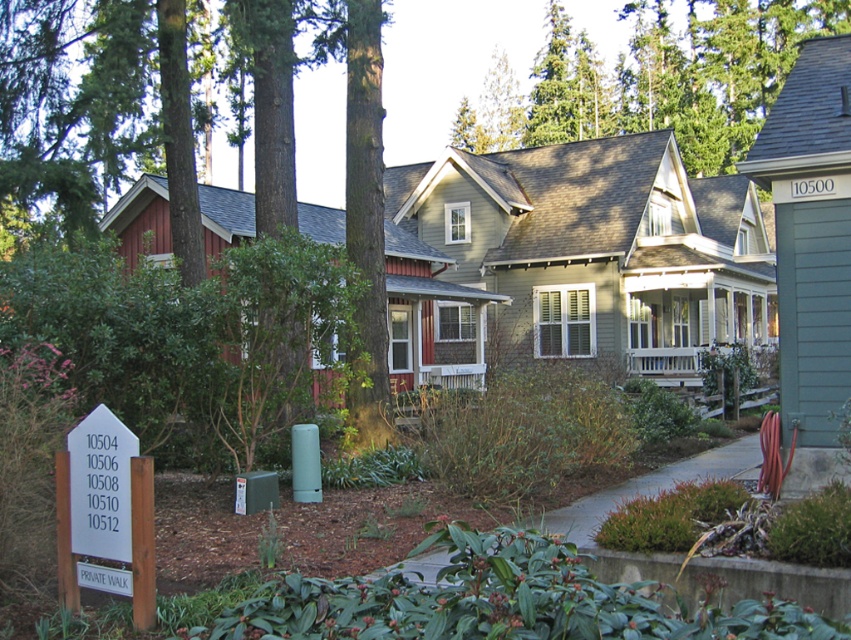
In the scene shown: Can you confirm if white plastic sign at lower left is positioned below white wooden porch at center?

Yes.

Between white plastic sign at lower left and white wooden porch at center, which one is positioned higher?

white wooden porch at center is above.

You are a GUI agent. You are given a task and a screenshot of the screen. Output one action in this format:
    pyautogui.click(x=<x>, y=<y>)
    Task: Click on the white plastic sign at lower left
    
    Given the screenshot: What is the action you would take?
    pyautogui.click(x=106, y=513)

Is green rough bark tree at left positioned behind white plastic sign at lower left?

Yes.

Is green rough bark tree at left to the left of white plastic sign at lower left from the viewer's perspective?

Yes, green rough bark tree at left is to the left of white plastic sign at lower left.

Which is behind, point (49, 29) or point (100, 545)?

The point (49, 29) is more distant.

Locate an element on the screen. This screenshot has height=640, width=851. green rough bark tree at left is located at coordinates (98, 109).

Measure the distance from green textured tree at upper center to white wooden porch at center.

green textured tree at upper center and white wooden porch at center are 91.41 feet apart from each other.

Where is `green textured tree at upper center`? Image resolution: width=851 pixels, height=640 pixels. green textured tree at upper center is located at coordinates (657, 80).

Where is `green textured tree at upper center`? green textured tree at upper center is located at coordinates (657, 80).

Identify the location of green textured tree at upper center. (657, 80).